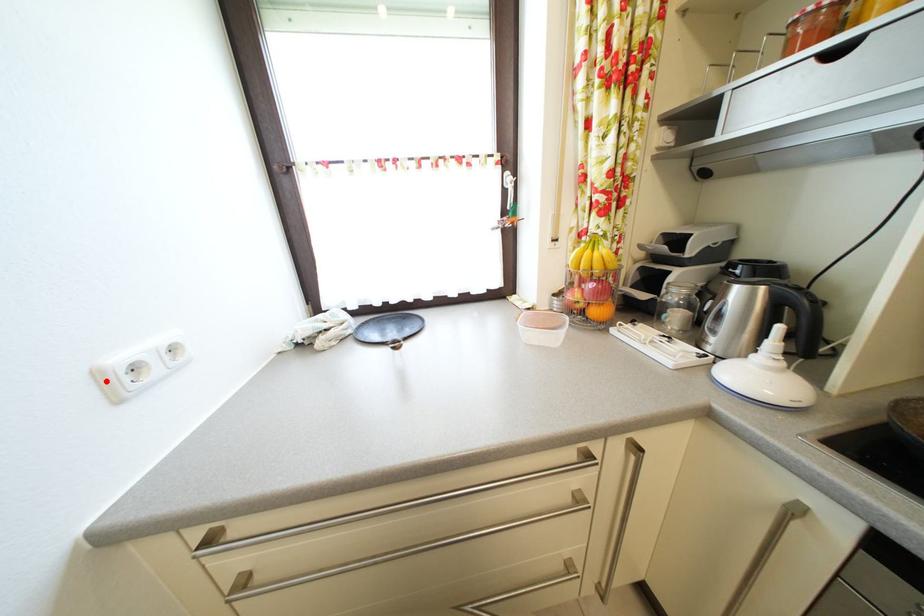
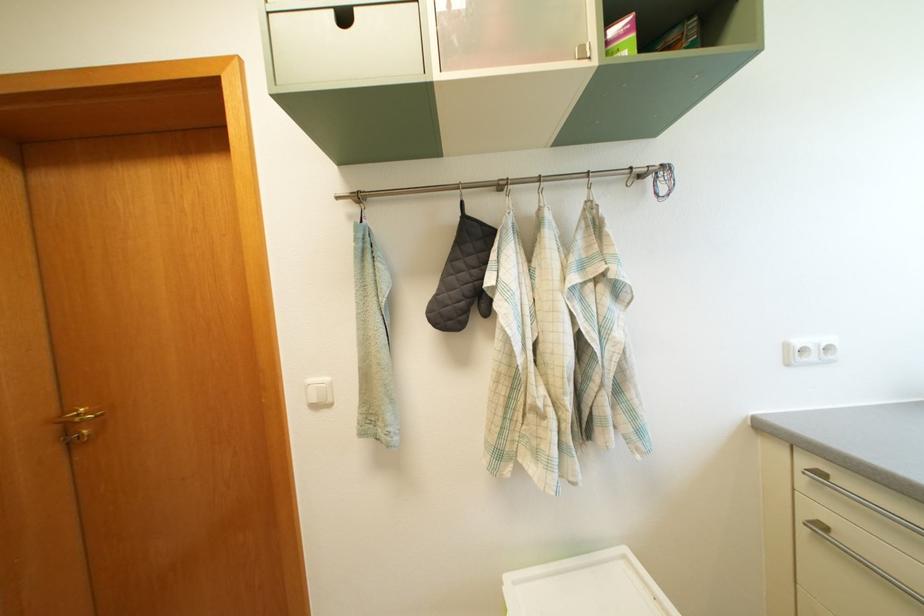
Locate, in the second image, the point that corresponds to the highlighted location in the first image.

(795, 353)